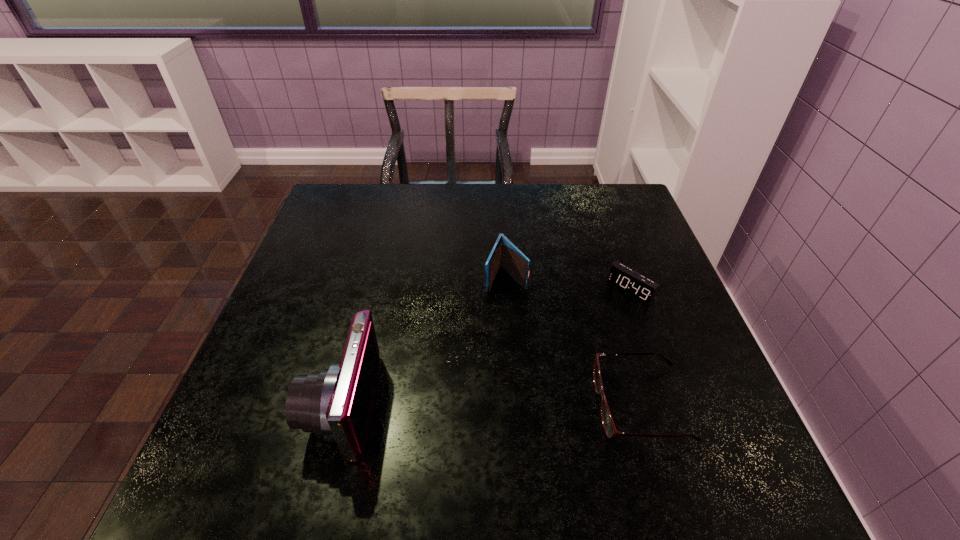
The width and height of the screenshot is (960, 540). In order to click on vacant area that lies between the shortest object and the third object from right to left in this screenshot , I will do `click(573, 341)`.

Locate an element on the screen. The image size is (960, 540). vacant point located between the third shortest object and the shortest object is located at coordinates (573, 341).

Where is `object that stands as the closest to the shortest object`? Image resolution: width=960 pixels, height=540 pixels. object that stands as the closest to the shortest object is located at coordinates (634, 284).

This screenshot has height=540, width=960. What are the coordinates of `object that is the third closest to the wallet` in the screenshot? It's located at (335, 403).